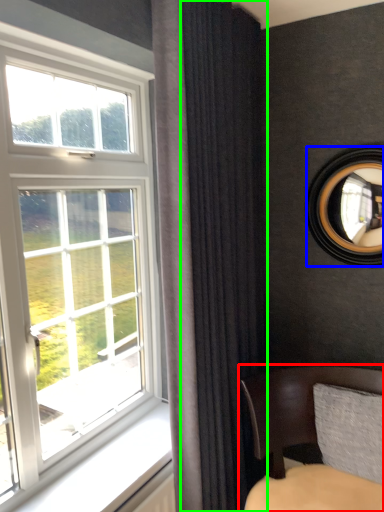
Question: Which object is positioned closest to chair (highlighted by a red box)? Select from mirror (highlighted by a blue box) and curtain (highlighted by a green box).

Choices:
 (A) mirror
 (B) curtain

Answer: (B)